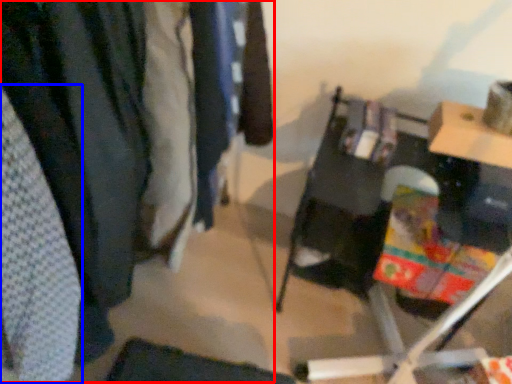
Question: Which point is closer to the camera, closet (highlighted by a red box) or clothing (highlighted by a blue box)?

Choices:
 (A) closet
 (B) clothing

Answer: (B)